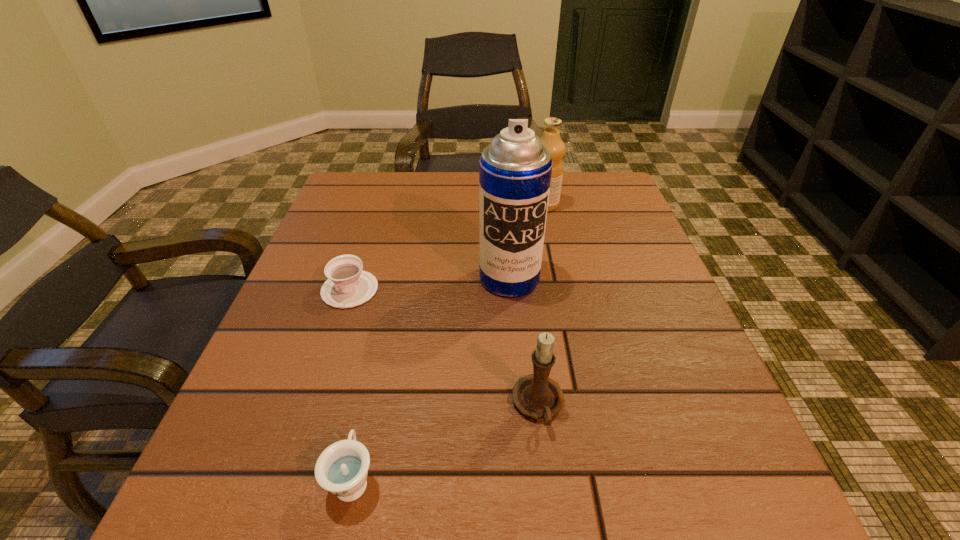
The height and width of the screenshot is (540, 960). I want to click on vacant region that satisfies the following two spatial constraints: 1. on the label of the olive oil; 2. on the label side of the tallest object, so click(x=559, y=278).